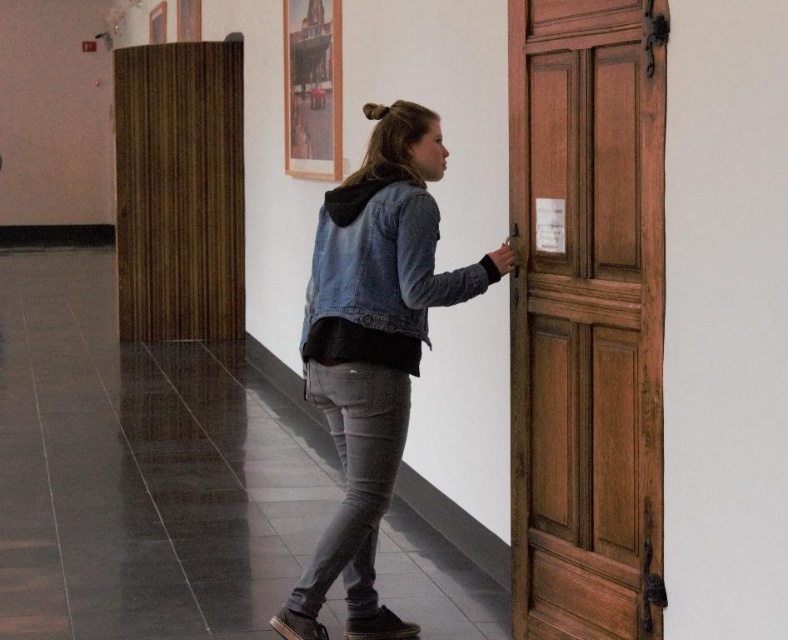
Question: Which point is farther to the camera?

Choices:
 (A) coord(365,368)
 (B) coord(647,61)

Answer: (A)

Question: Among these objects, which one is nearest to the camera?

Choices:
 (A) denim jacket at center
 (B) wooden panelled door at right

Answer: (B)

Question: Does wooden panelled door at right have a greater width compared to denim jacket at center?

Choices:
 (A) yes
 (B) no

Answer: (B)

Question: Does wooden panelled door at right have a larger size compared to denim jacket at center?

Choices:
 (A) no
 (B) yes

Answer: (B)

Question: Is wooden panelled door at right to the right of denim jacket at center from the viewer's perspective?

Choices:
 (A) yes
 (B) no

Answer: (A)